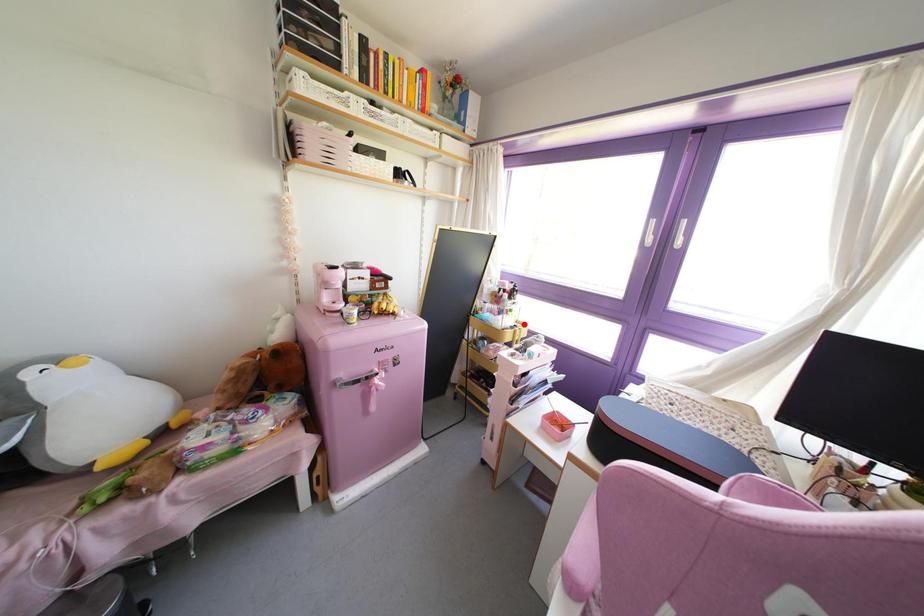
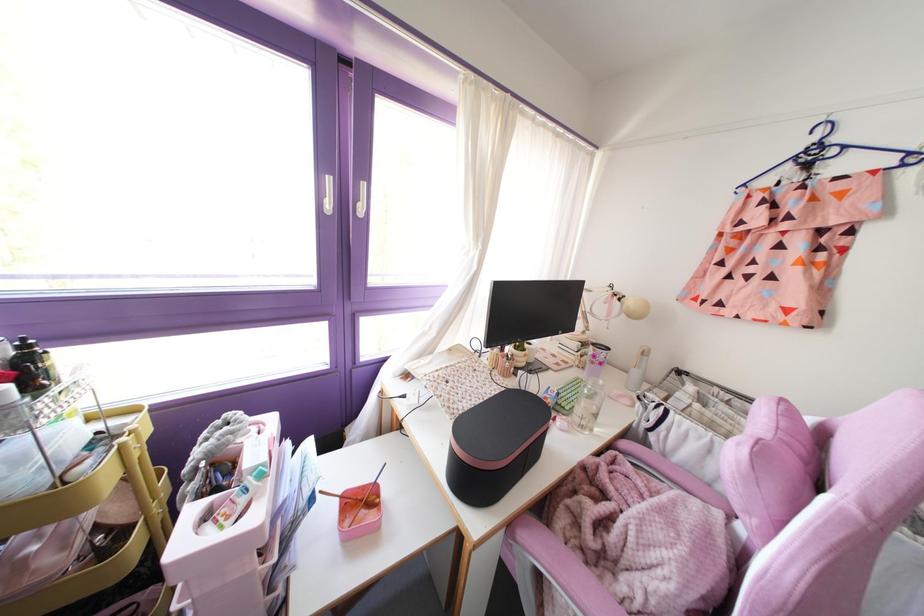
In the second image, find the point that corresponds to the highlighted location in the first image.

(130, 411)